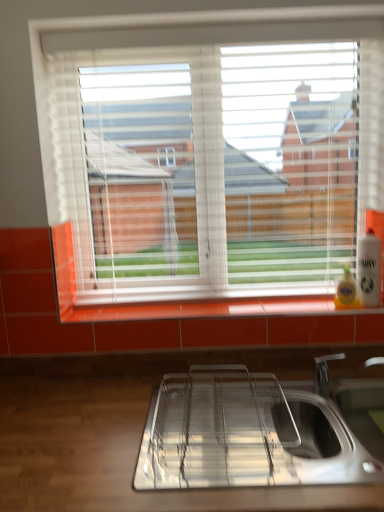
Question: From a real-world perspective, is white plastic blinds at upper center positioned above or below polished stainless steel sink at lower center?

Choices:
 (A) below
 (B) above

Answer: (B)

Question: Would you say white plastic blinds at upper center is to the left or to the right of polished stainless steel sink at lower center in the picture?

Choices:
 (A) left
 (B) right

Answer: (A)

Question: Estimate the real-world distances between objects in this image. Which object is farther from the polished stainless steel sink at lower center?

Choices:
 (A) white plastic bottle at right
 (B) white plastic blinds at upper center

Answer: (B)

Question: Which is farther from the white plastic bottle at right?

Choices:
 (A) white plastic blinds at upper center
 (B) polished stainless steel sink at lower center

Answer: (A)